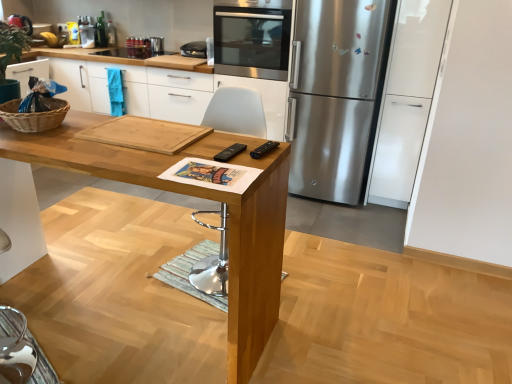
Image resolution: width=512 pixels, height=384 pixels. What are the coordinates of `blank space situated above natural wood cutting board at center (from a real-world perspective)` in the screenshot? It's located at (157, 125).